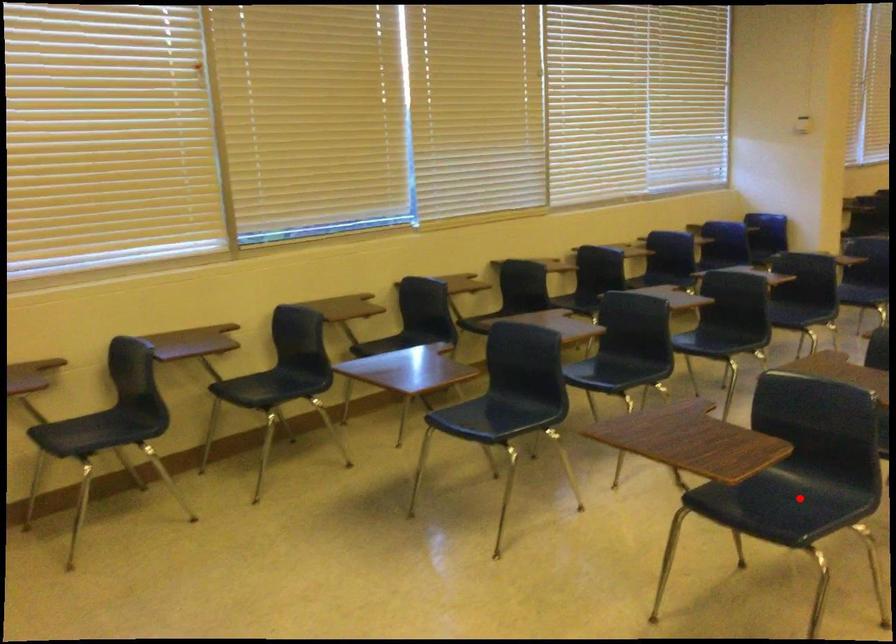
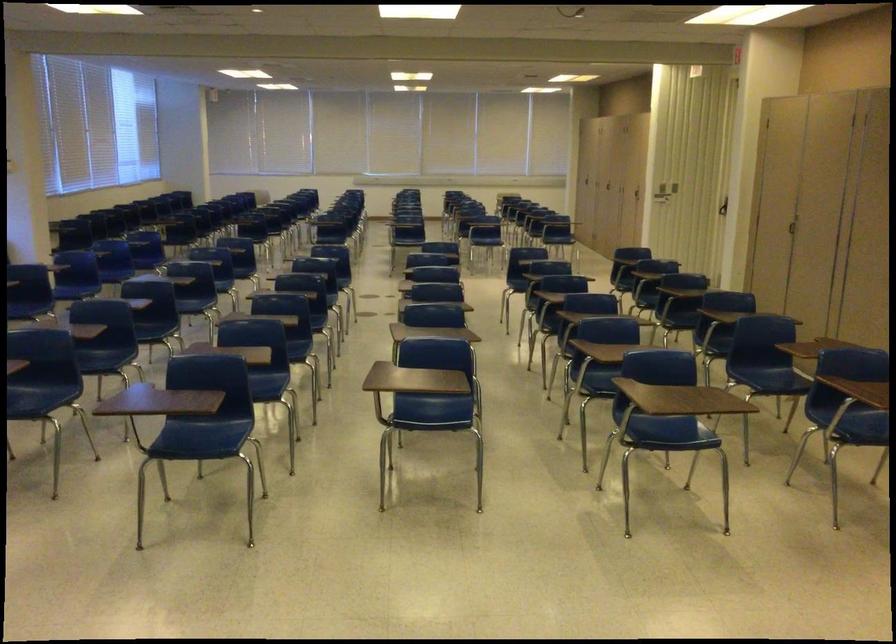
In the second image, find the point that corresponds to the highlighted location in the first image.

(39, 395)